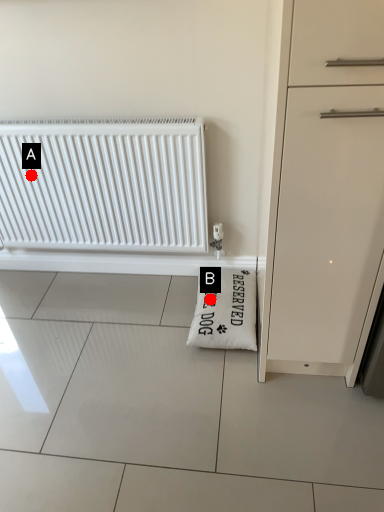
Question: Two points are circled on the image, labeled by A and B beside each circle. Which point is closer to the camera?

Choices:
 (A) A is closer
 (B) B is closer

Answer: (A)